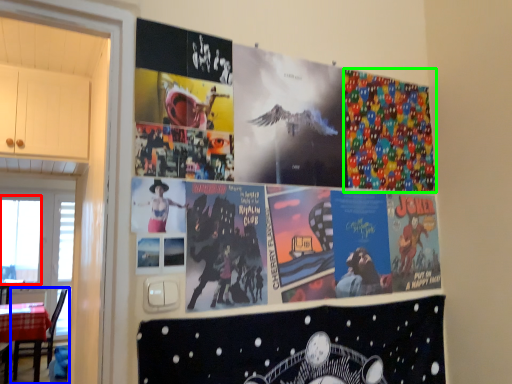
Question: Which object is positioned closest to window screen (highlighted by a red box)? Select from chair (highlighted by a blue box) and comic book (highlighted by a green box).

Choices:
 (A) chair
 (B) comic book

Answer: (A)